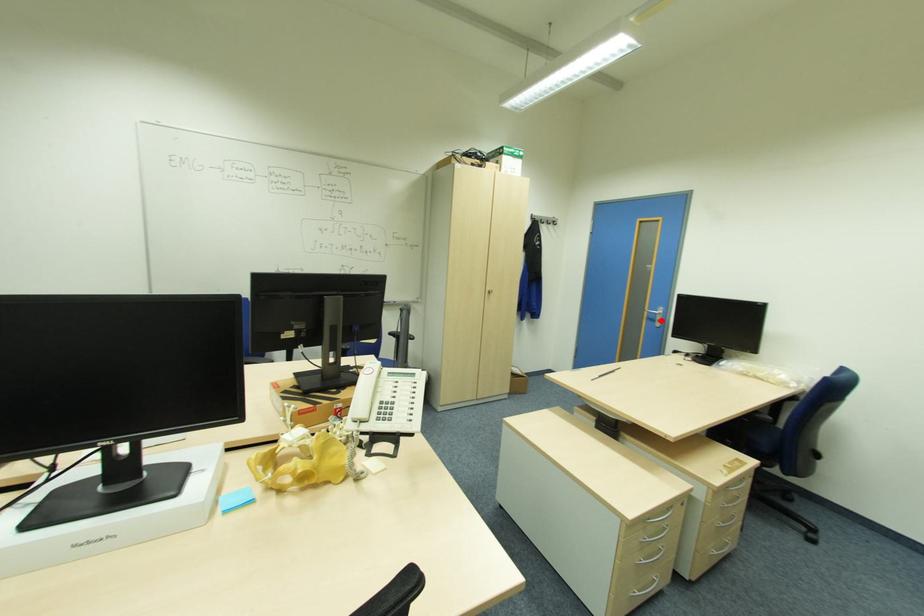
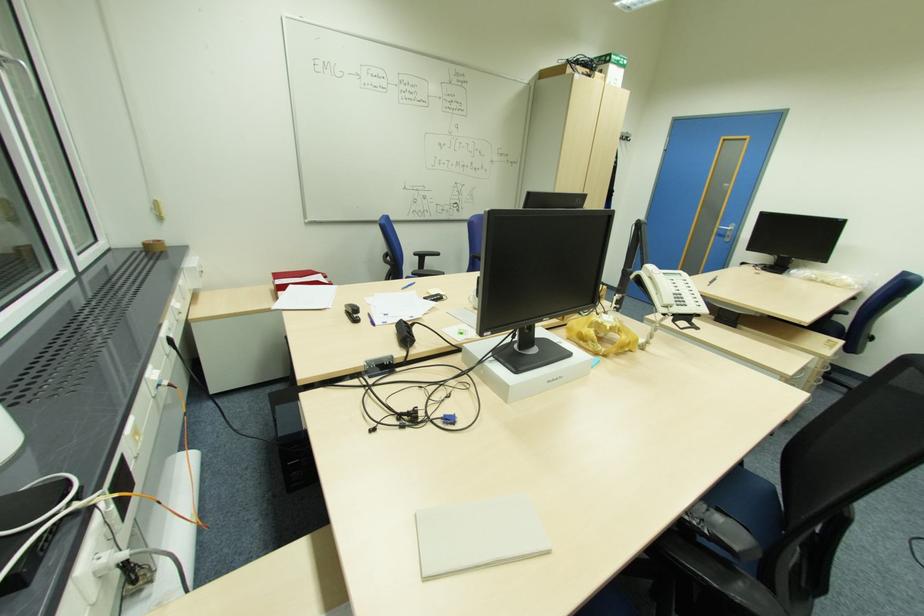
Find the pixel in the second image that matches the highlighted location in the first image.

(732, 236)